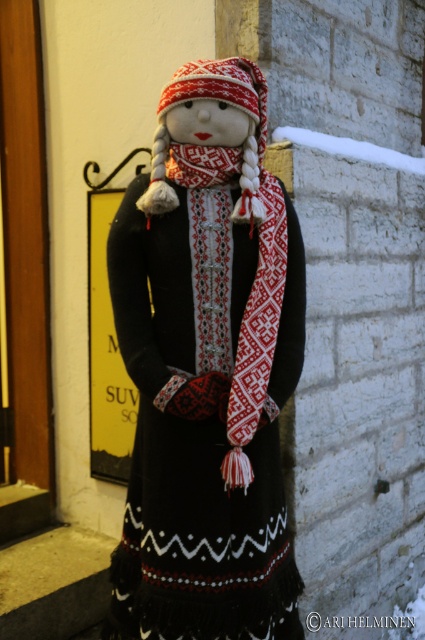
Does matte black dress at center appear over knitted wool scarf at center?

Actually, matte black dress at center is below knitted wool scarf at center.

Between point (232, 556) and point (269, 253), which one is positioned in front?

Positioned in front is point (232, 556).

Identify the location of matte black dress at center. Image resolution: width=425 pixels, height=640 pixels. (207, 369).